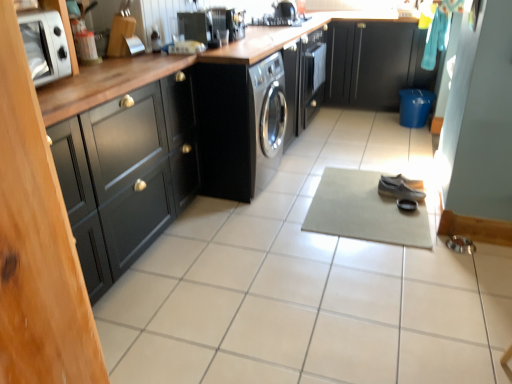
The image size is (512, 384). What are the coordinates of `free spot behind leather at center, positioned as the first shoe in back-to-front order` in the screenshot? It's located at (393, 172).